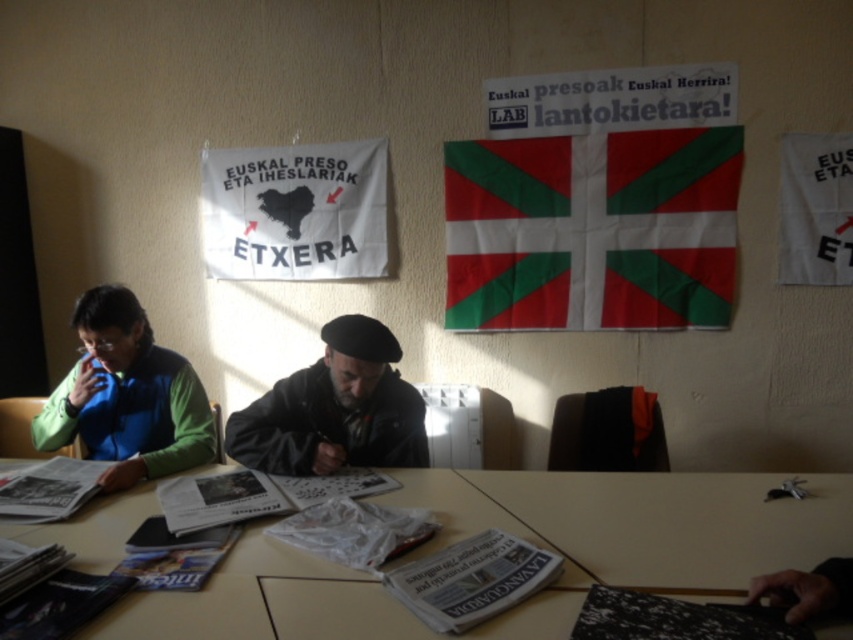
Question: Which point is farther from the camera taking this photo?

Choices:
 (A) (256, 406)
 (B) (535, 308)

Answer: (B)

Question: Which of these objects is positioned closest to the green matte jacket at left?

Choices:
 (A) smooth wooden table at lower center
 (B) dark gray beret at center
 (C) green and white fabric flag at upper center
 (D) white paper banner at upper center

Answer: (B)

Question: Does green fabric jacket at center come in front of white paper banner at upper center?

Choices:
 (A) yes
 (B) no

Answer: (A)

Question: Which object is closer to the camera taking this photo?

Choices:
 (A) wooden table at center
 (B) white paper banner at upper center
 (C) smooth wooden table at lower center
 (D) green matte jacket at left

Answer: (A)

Question: Considering the relative positions of wooden table at center and green matte jacket at left in the image provided, where is wooden table at center located with respect to green matte jacket at left?

Choices:
 (A) left
 (B) right

Answer: (B)

Question: Is smooth wooden table at lower center wider than dark gray beret at center?

Choices:
 (A) yes
 (B) no

Answer: (A)